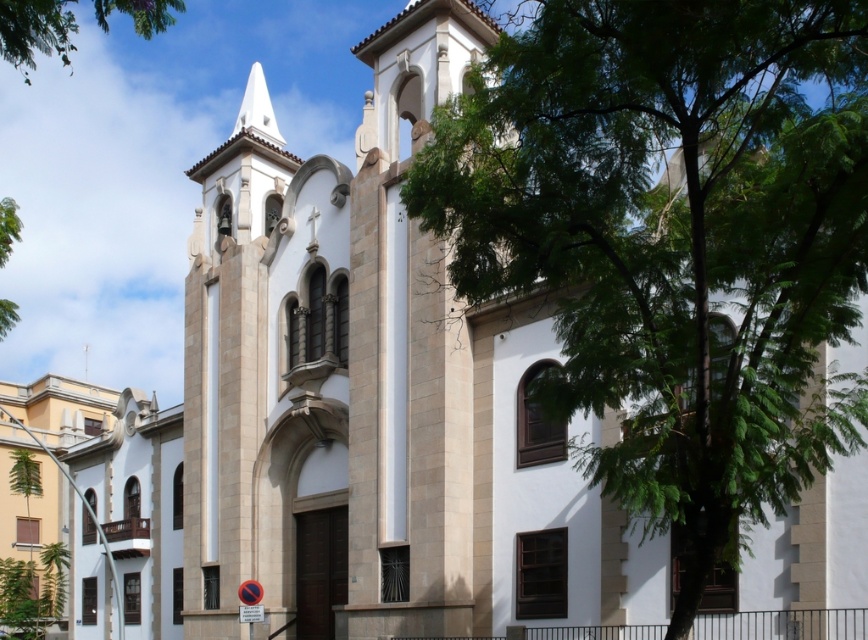
You are standing in front of the church and want to take a photo of the bell tower. There are two green leafy trees in your view. Which tree, the green leafy tree at center or the green leafy tree at upper left, is blocking your view more?

The green leafy tree at center is closer to the viewer than the green leafy tree at upper left, so it is blocking your view more.

You are standing in front of the church and want to take a photo of the entire building without any obstructions. The green leafy tree at center is blocking part of the view. Where should you move to ensure the tree is out of the frame?

Move to the left side of the church to avoid the green leafy tree at center blocking the view.

You are standing in front of the church and want to take a photo. There are two points marked on the image, point A at coordinates point (x=674, y=324) and point B at coordinates point (x=56, y=29). Which point is closer to your camera lens?

Point A at coordinates point (x=674, y=324) is closer to the camera lens than point B at coordinates point (x=56, y=29).